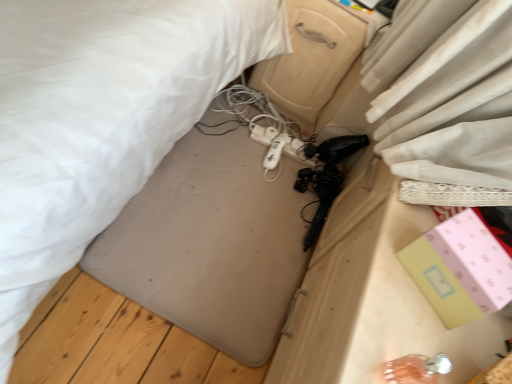
Question: Is white plastic extension cord at center not inside pink paper box at lower right?

Choices:
 (A) yes
 (B) no

Answer: (A)

Question: Does white plastic extension cord at center have a greater width compared to pink paper box at lower right?

Choices:
 (A) no
 (B) yes

Answer: (A)

Question: Is white plastic extension cord at center facing towards pink paper box at lower right?

Choices:
 (A) yes
 (B) no

Answer: (B)

Question: Is white plastic extension cord at center positioned with its back to pink paper box at lower right?

Choices:
 (A) yes
 (B) no

Answer: (B)

Question: Is white plastic extension cord at center further to the viewer compared to pink paper box at lower right?

Choices:
 (A) yes
 (B) no

Answer: (A)

Question: Is pink paper box at lower right wider or thinner than beige plastic drawer at center?

Choices:
 (A) wide
 (B) thin

Answer: (B)

Question: In terms of height, does pink paper box at lower right look taller or shorter compared to beige plastic drawer at center?

Choices:
 (A) tall
 (B) short

Answer: (B)

Question: Is pink paper box at lower right bigger or smaller than beige plastic drawer at center?

Choices:
 (A) big
 (B) small

Answer: (B)

Question: From a real-world perspective, relative to beige plastic drawer at center, is pink paper box at lower right vertically above or below?

Choices:
 (A) below
 (B) above

Answer: (B)

Question: Relative to white plastic hairdryer at center, is pink paper box at lower right in front or behind?

Choices:
 (A) front
 (B) behind

Answer: (A)

Question: Considering the positions of pink paper box at lower right and white plastic hairdryer at center in the image, is pink paper box at lower right wider or thinner than white plastic hairdryer at center?

Choices:
 (A) wide
 (B) thin

Answer: (B)

Question: Would you say pink paper box at lower right is inside or outside white plastic hairdryer at center?

Choices:
 (A) outside
 (B) inside

Answer: (A)

Question: Considering the positions of point (485, 244) and point (274, 158), is point (485, 244) closer or farther from the camera than point (274, 158)?

Choices:
 (A) closer
 (B) farther

Answer: (A)

Question: In terms of size, does white plastic hairdryer at center appear bigger or smaller than beige plastic drawer at center?

Choices:
 (A) big
 (B) small

Answer: (B)

Question: From the image's perspective, is white plastic hairdryer at center located above or below beige plastic drawer at center?

Choices:
 (A) above
 (B) below

Answer: (B)